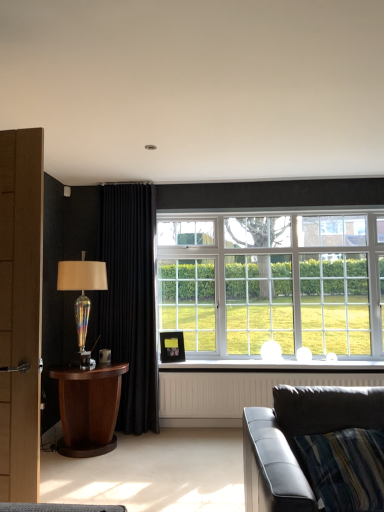
At what (x,y) coordinates should I click in order to perform the action: click on vacant point above white textured radiator at lower center (from a real-world perspective). Please return your answer as a coordinate pair (x, y). This screenshot has height=512, width=384. Looking at the image, I should click on (289, 361).